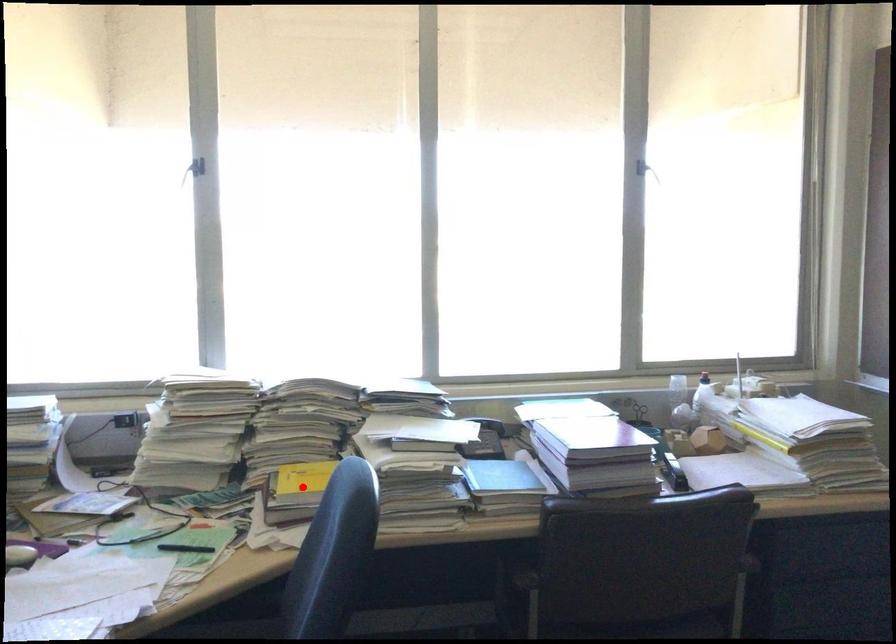
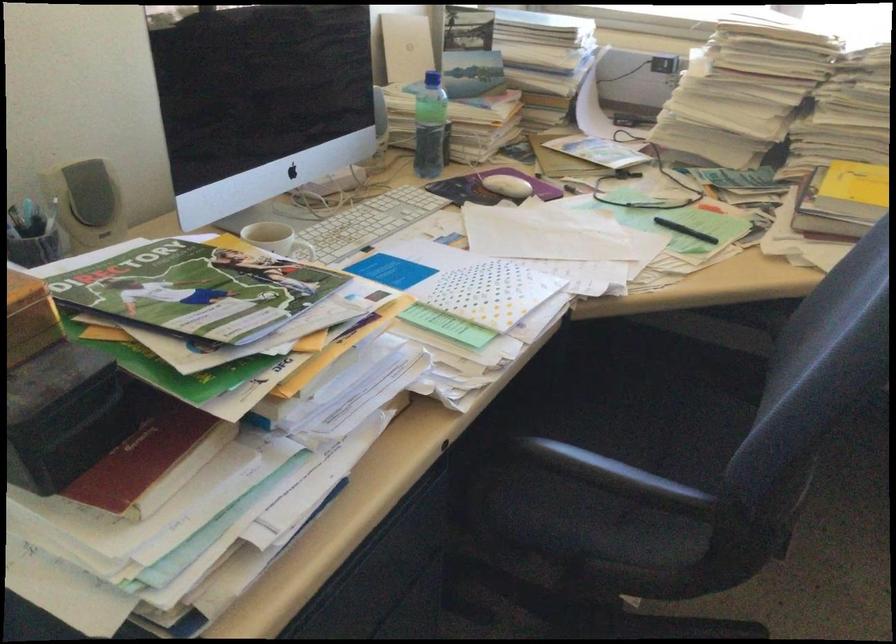
Question: I am providing you with two images of the same scene from different viewpoints. Given a red point in image1, look at the same physical point in image2. Is it:

Choices:
 (A) Closer to the viewpoint
 (B) Farther from the viewpoint

Answer: (A)